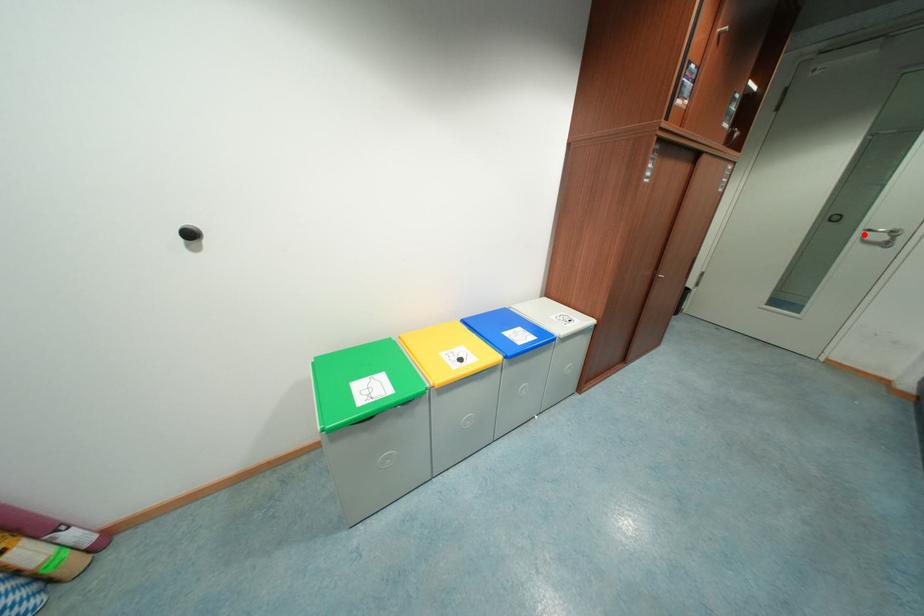
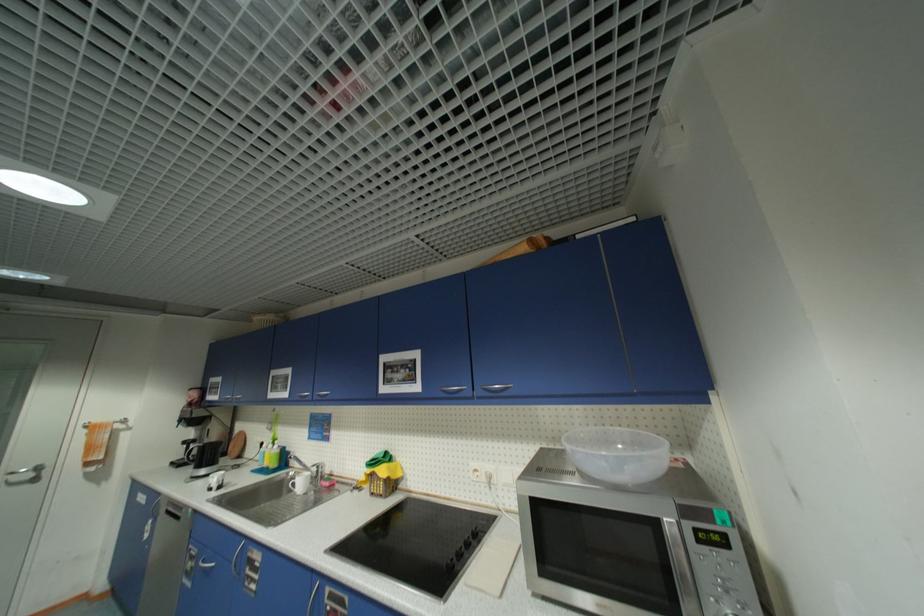
Question: I am providing you with two images of the same scene from different viewpoints. A red point is shown in image1. For the corresponding object point in image2, is it positioned nearer or farther from the camera?

Choices:
 (A) Nearer
 (B) Farther

Answer: (A)